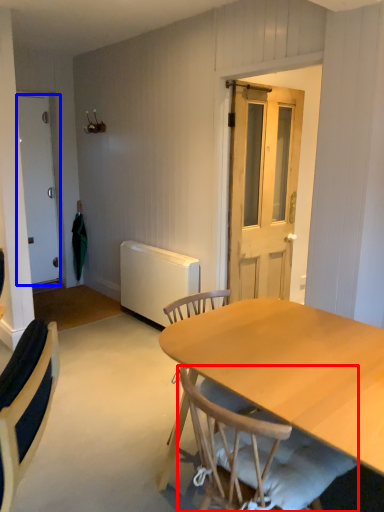
Question: Which point is further to the camera, chair (highlighted by a red box) or door (highlighted by a blue box)?

Choices:
 (A) chair
 (B) door

Answer: (B)